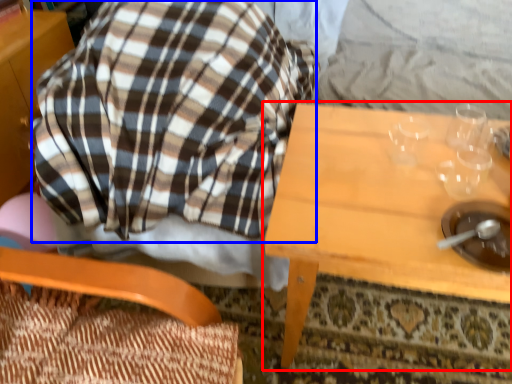
Question: Which object is further to the camera taking this photo, table (highlighted by a red box) or flannel (highlighted by a blue box)?

Choices:
 (A) table
 (B) flannel

Answer: (A)